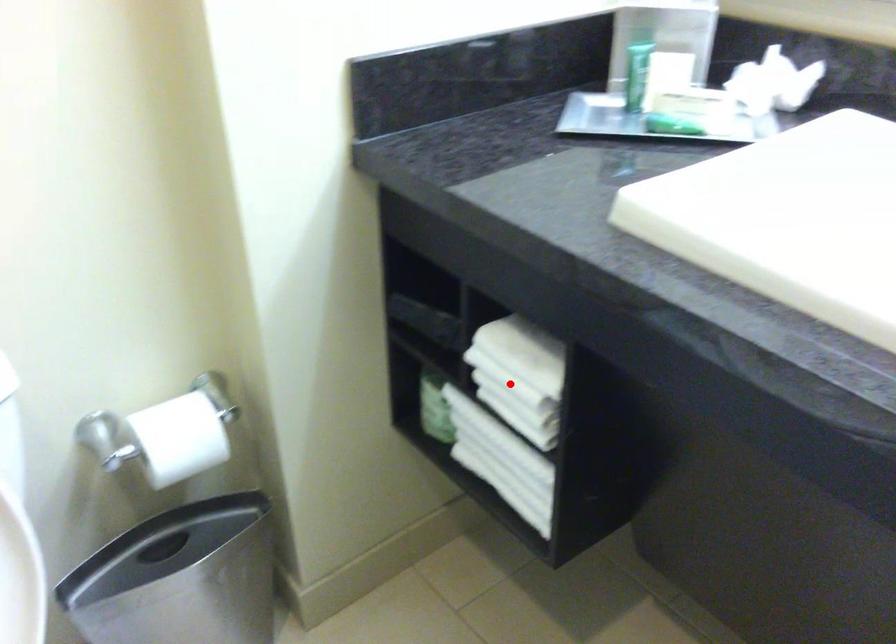
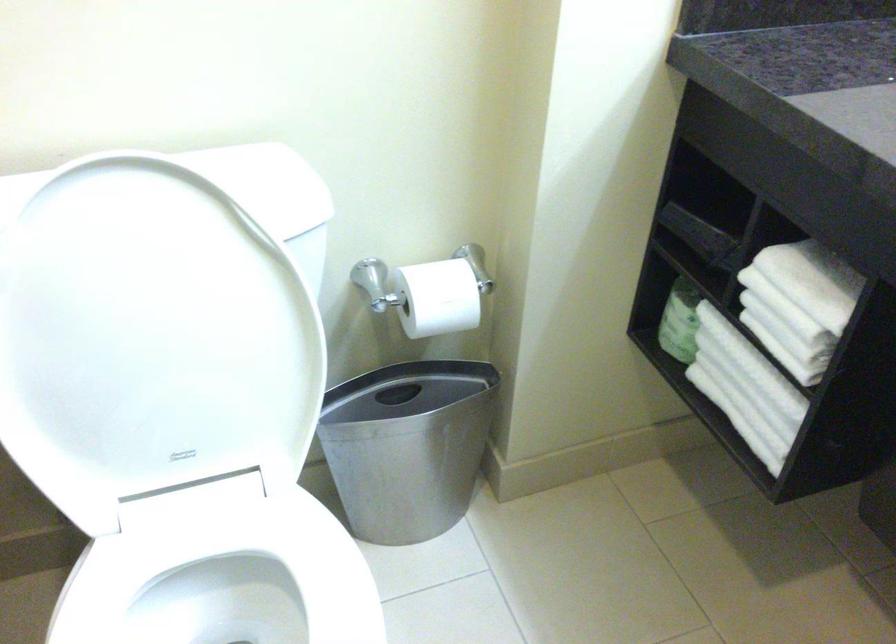
The point at the highlighted location is marked in the first image. Where is the corresponding point in the second image?

(785, 308)